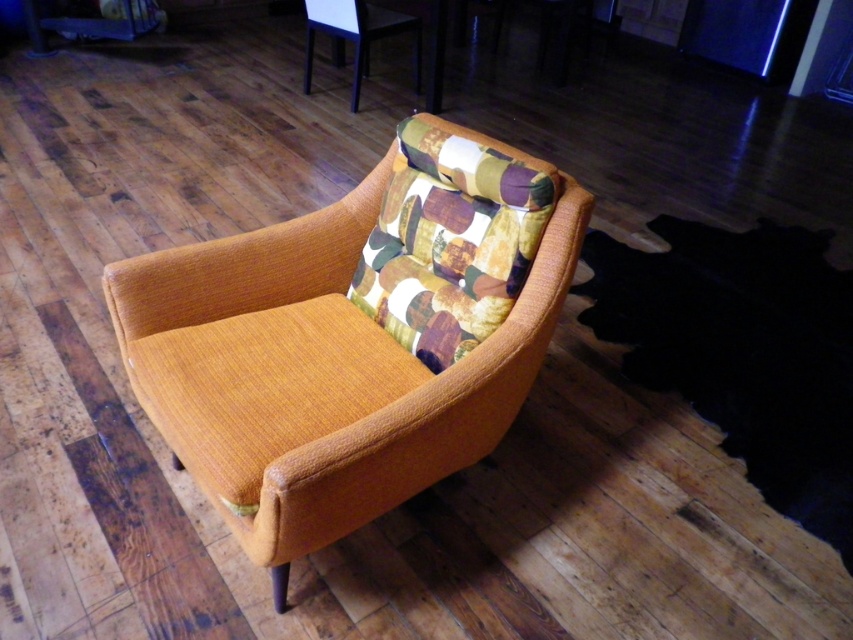
You are a delivery person who needs to place a new lamp on the floor next to the mustard fabric armchair at center and the textured fabric chair at upper center. Which chair should you avoid placing the lamp too close to, based on their heights?

The mustard fabric armchair at center is taller than the textured fabric chair at upper center, so you should avoid placing the lamp too close to the mustard fabric armchair at center to prevent it from being obscured or knocked over by its height.

You are standing in a room with a mustard fabric armchair at center and a textured fabric chair at upper center. You want to place a 3.5 meter long sofa between them. Is there enough space?

The mustard fabric armchair at center is 2.71 meters away from the textured fabric chair at upper center. Since the sofa is 3.5 meters long, there isn not enough space between them to place the sofa.

You are standing in a room with a mustard fabric armchair at center and a textured fabric chair at upper center. Which chair is positioned higher up in the room?

The textured fabric chair at upper center is positioned higher up in the room than the mustard fabric armchair at center.